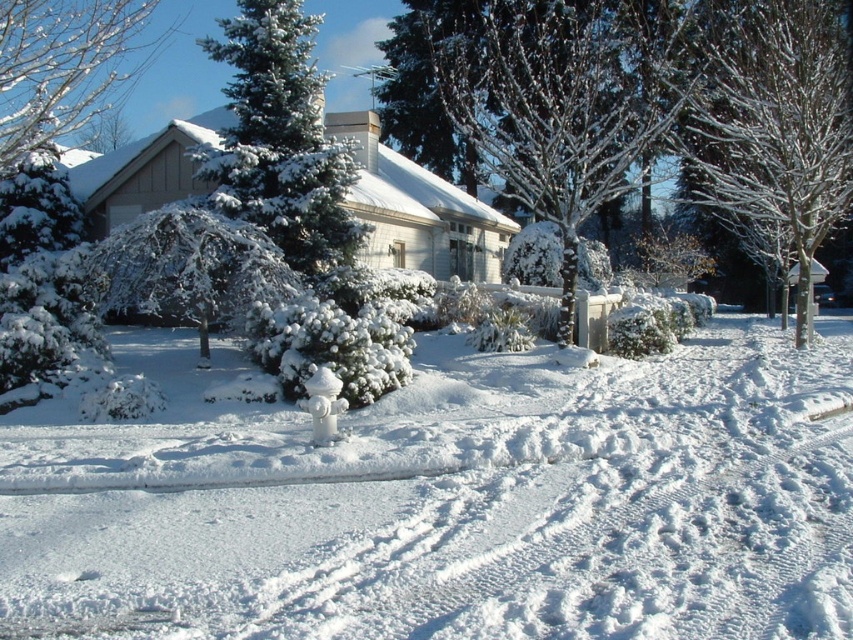
Between frosty bark tree at center and green snow-covered evergreen at center, which one is positioned lower?

Positioned lower is green snow-covered evergreen at center.

Is point (531, 36) positioned after point (273, 202)?

Yes, point (531, 36) is farther from viewer.

Where is `frosty bark tree at center`? This screenshot has height=640, width=853. frosty bark tree at center is located at coordinates (560, 99).

Looking at this image, measure the distance between white fluffy snow at center and camera.

white fluffy snow at center and camera are 4.79 meters apart from each other.

Does white fluffy snow at center have a larger size compared to green snow-covered evergreen at center?

Correct, white fluffy snow at center is larger in size than green snow-covered evergreen at center.

Which is in front, point (543, 557) or point (268, 65)?

Point (543, 557)

You are a GUI agent. You are given a task and a screenshot of the screen. Output one action in this format:
    pyautogui.click(x=<x>, y=<y>)
    Task: Click on the white fluffy snow at center
    
    Given the screenshot: What is the action you would take?
    pyautogui.click(x=447, y=500)

Where is `white snow-covered tree at upper right`? white snow-covered tree at upper right is located at coordinates (772, 120).